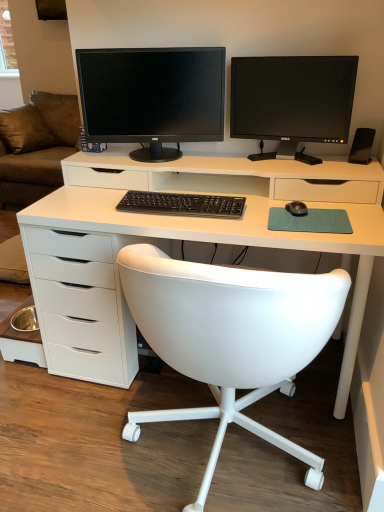
Question: From a real-world perspective, relative to black glossy monitor at upper right, which is counted as the 1th computer monitor, starting from the right, is white leather chair at center vertically above or below?

Choices:
 (A) below
 (B) above

Answer: (A)

Question: In terms of width, does white leather chair at center look wider or thinner when compared to black glossy monitor at upper right, which is counted as the second computer monitor, starting from the left?

Choices:
 (A) thin
 (B) wide

Answer: (B)

Question: Considering the real-world distances, which object is farthest from the white matte desk at center?

Choices:
 (A) brown fabric couch at left
 (B) black glossy monitor at upper right, which is counted as the second computer monitor, starting from the left
 (C) black glossy monitor at upper center, the 2th computer monitor in the right-to-left sequence
 (D) black matte mouse at right
 (E) white leather chair at center

Answer: (A)

Question: Estimate the real-world distances between objects in this image. Which object is closer to the black plastic speaker at right?

Choices:
 (A) white matte desk at center
 (B) black glossy monitor at upper center, which is the first computer monitor in left-to-right order
 (C) brown fabric couch at left
 (D) black plastic keyboard at center
 (E) white leather chair at center

Answer: (A)